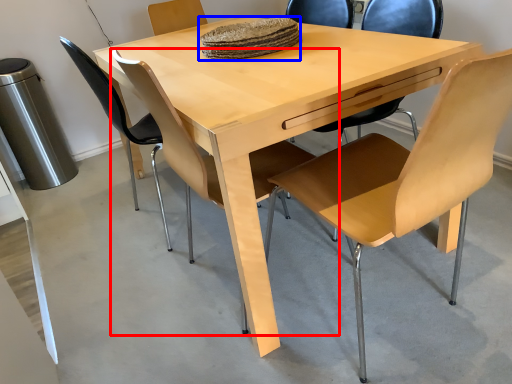
Question: Among these objects, which one is nearest to the camera, chair (highlighted by a red box) or food (highlighted by a blue box)?

Choices:
 (A) chair
 (B) food

Answer: (A)